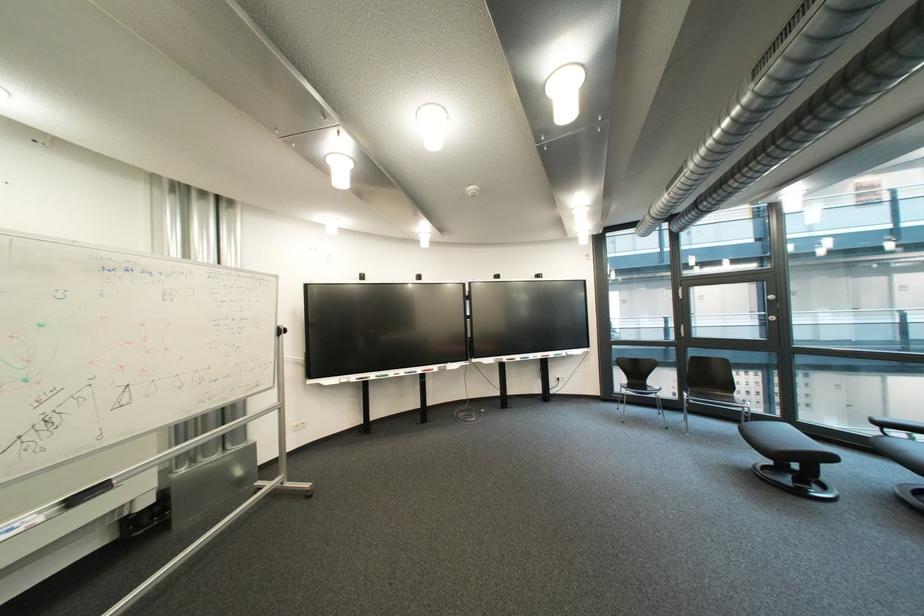
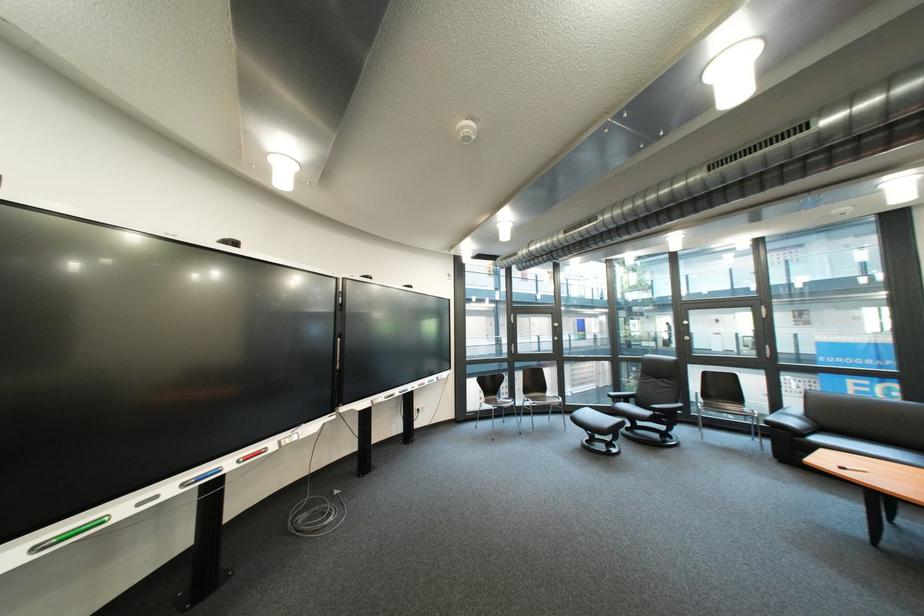
The point at (673,416) is marked in the first image. Where is the corresponding point in the second image?

(517, 424)